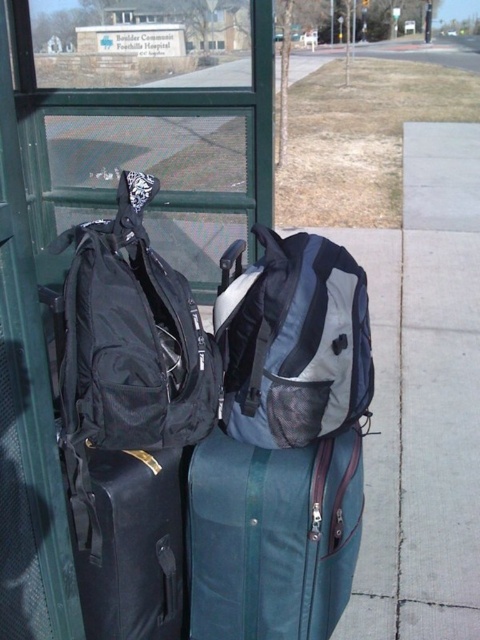
Question: Among these points, which one is farthest from the camera?

Choices:
 (A) (168, 497)
 (B) (179, 406)

Answer: (A)

Question: Which of these objects is positioned closest to the brushed metal water at bottle left?

Choices:
 (A) black fabric backpack at left
 (B) matte black backpack at left

Answer: (A)

Question: Does gray fabric backpack at center appear on the left side of matte black backpack at left?

Choices:
 (A) no
 (B) yes

Answer: (B)

Question: Does matte black suitcase at left appear on the right side of matte black backpack at left?

Choices:
 (A) yes
 (B) no

Answer: (B)

Question: Which of these objects is positioned closest to the teal fabric suitcase at center?

Choices:
 (A) brushed metal water at bottle left
 (B) black fabric backpack at left

Answer: (B)

Question: Can you confirm if black fabric backpack at left is positioned to the left of brushed metal water at bottle left?

Choices:
 (A) yes
 (B) no

Answer: (B)